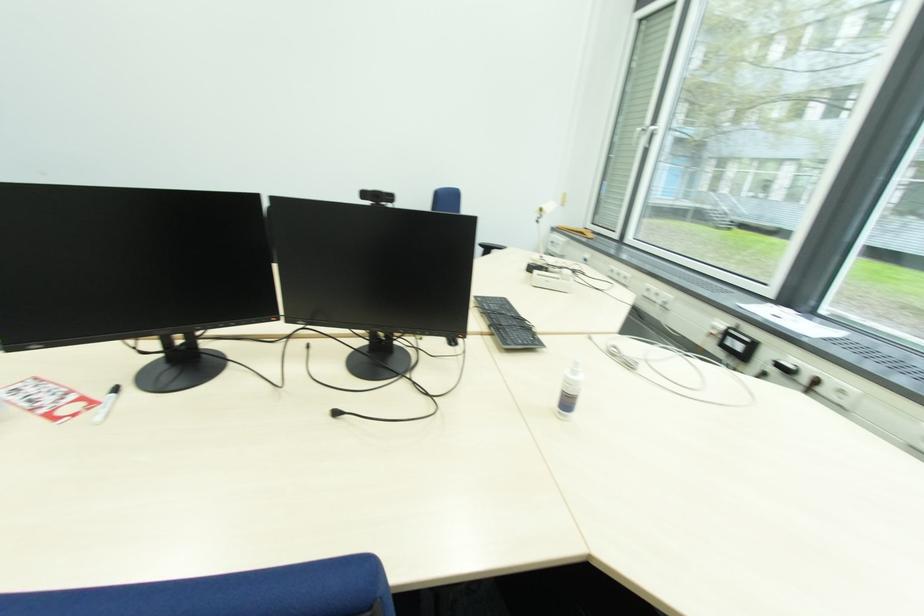
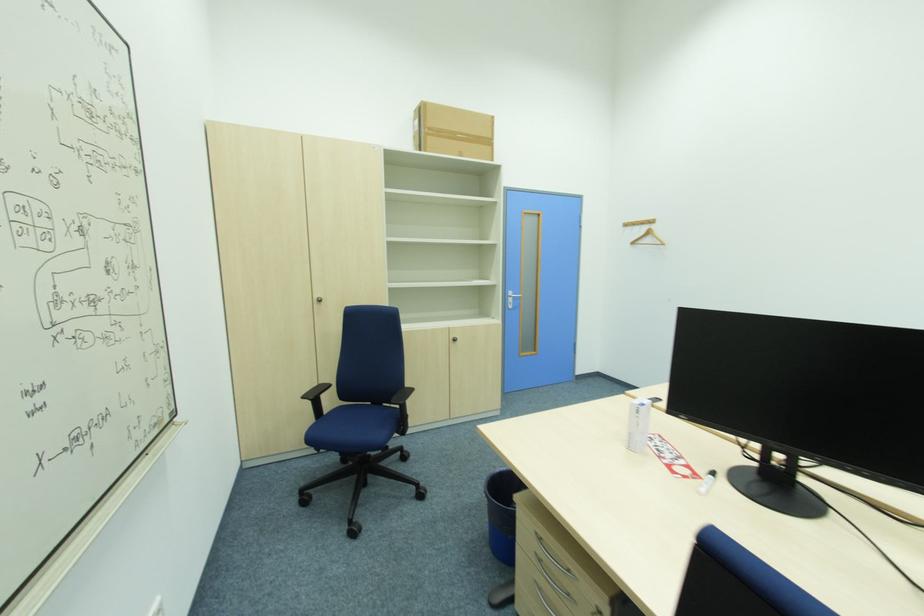
Question: The camera is either moving clockwise (left) or counter-clockwise (right) around the object. The first image is from the beginning of the video and the second image is from the end. Is the camera moving left or right when shooting the video?

Choices:
 (A) Left
 (B) Right

Answer: (B)